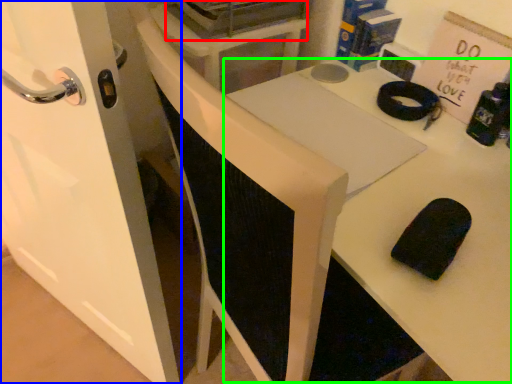
Question: Which object is positioned farthest from appliance (highlighted by a red box)? Select from door (highlighted by a blue box) and table (highlighted by a green box).

Choices:
 (A) door
 (B) table

Answer: (A)